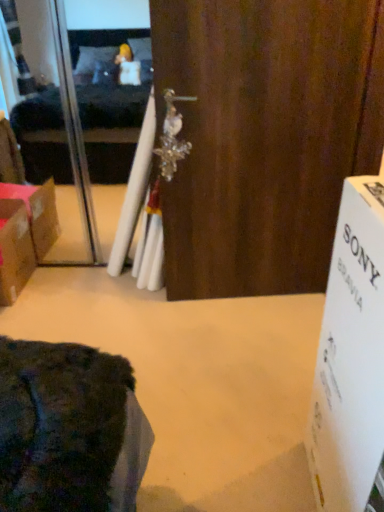
Question: Considering the positions of white cardboard box at right and transparent plastic screen door at upper left in the image, is white cardboard box at right bigger or smaller than transparent plastic screen door at upper left?

Choices:
 (A) small
 (B) big

Answer: (A)

Question: Is white cardboard box at right to the left or to the right of transparent plastic screen door at upper left in the image?

Choices:
 (A) left
 (B) right

Answer: (B)

Question: Considering the real-world distances, which object is farthest from the wooden door at center?

Choices:
 (A) white cardboard box at right
 (B) brown cardboard box at left
 (C) transparent plastic screen door at upper left

Answer: (B)

Question: Estimate the real-world distances between objects in this image. Which object is farther from the transparent plastic screen door at upper left?

Choices:
 (A) white cardboard box at right
 (B) brown cardboard box at left
 (C) wooden door at center

Answer: (A)